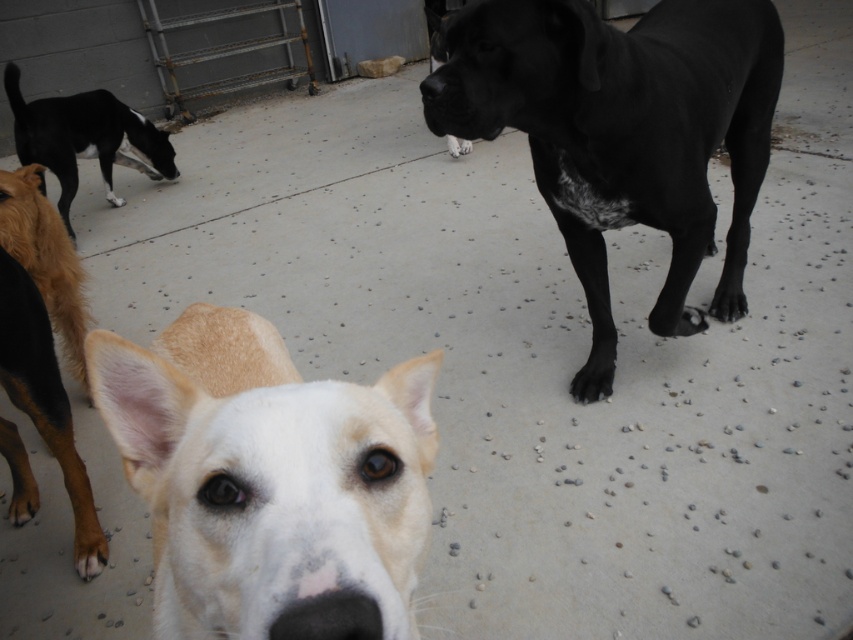
Is brown fur at lower left wider than black glossy dog at upper left?

No.

Does brown fur at lower left appear under black glossy dog at upper left?

Yes.

Describe the element at coordinates (45, 340) in the screenshot. This screenshot has height=640, width=853. I see `brown fur at lower left` at that location.

I want to click on brown fur at lower left, so click(x=45, y=340).

What do you see at coordinates (270, 480) in the screenshot? This screenshot has width=853, height=640. I see `white fur dog at center` at bounding box center [270, 480].

Can you confirm if white fur dog at center is positioned below brown fur at lower left?

No.

Who is more distant from viewer, [376,540] or [73,369]?

Positioned behind is point [73,369].

Image resolution: width=853 pixels, height=640 pixels. Identify the location of white fur dog at center. (270, 480).

Based on the photo, does black smooth dog at upper right lie behind brown fur at lower left?

That is True.

Which is more to the left, black smooth dog at upper right or brown fur at lower left?

From the viewer's perspective, brown fur at lower left appears more on the left side.

Identify the location of black smooth dog at upper right. This screenshot has width=853, height=640. click(624, 132).